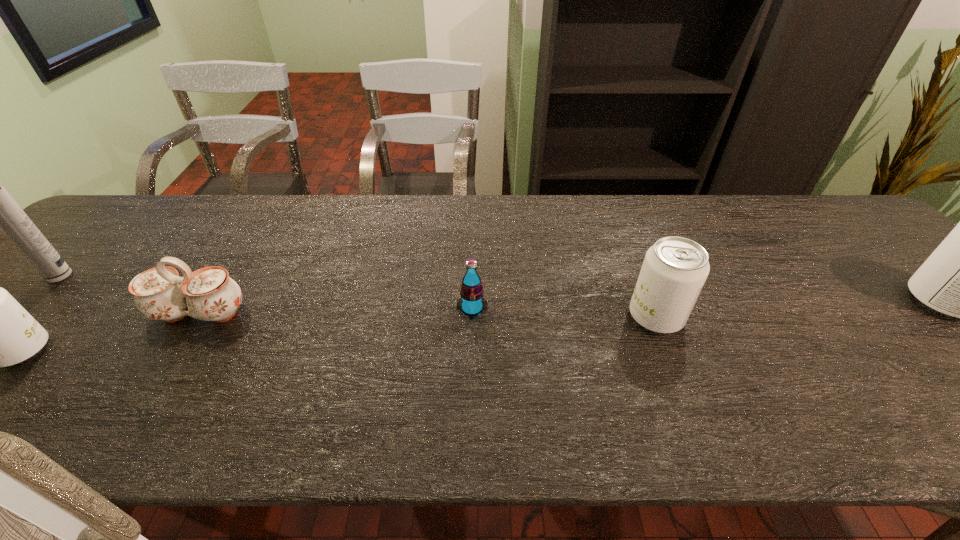
The image size is (960, 540). I want to click on vacant spot for a new pop_(soda) to ensure equal spacing, so click(x=350, y=333).